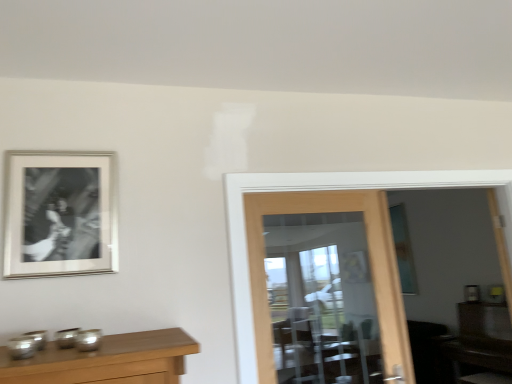
Question: From a real-world perspective, relative to silver/metallic photo frame at upper left, is brown wooden dresser at lower right vertically above or below?

Choices:
 (A) above
 (B) below

Answer: (B)

Question: From their relative heights in the image, would you say brown wooden dresser at lower right is taller or shorter than silver/metallic photo frame at upper left?

Choices:
 (A) short
 (B) tall

Answer: (B)

Question: Which object is positioned farthest from the brown wooden dresser at lower right?

Choices:
 (A) silver/metallic photo frame at upper left
 (B) clear glass door at center

Answer: (A)

Question: Estimate the real-world distances between objects in this image. Which object is farther from the silver/metallic photo frame at upper left?

Choices:
 (A) clear glass door at center
 (B) brown wooden dresser at lower right

Answer: (B)